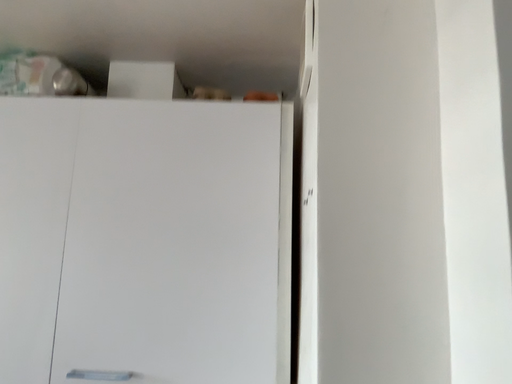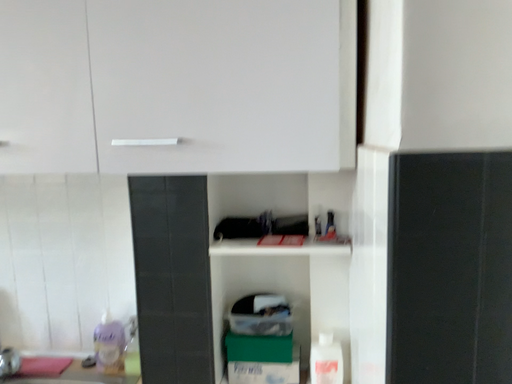
Question: How did the camera likely rotate when shooting the video?

Choices:
 (A) rotated upward
 (B) rotated downward

Answer: (B)